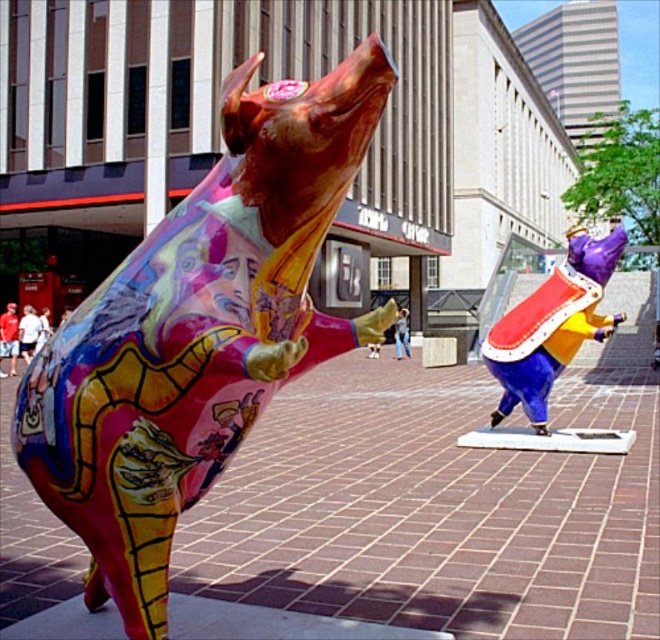
Who is higher up, multicolored painted bull at center or shiny purple and gold helmet at center?

shiny purple and gold helmet at center is above.

Identify the location of multicolored painted bull at center. (199, 332).

The height and width of the screenshot is (640, 660). In order to click on multicolored painted bull at center in this screenshot , I will do `click(199, 332)`.